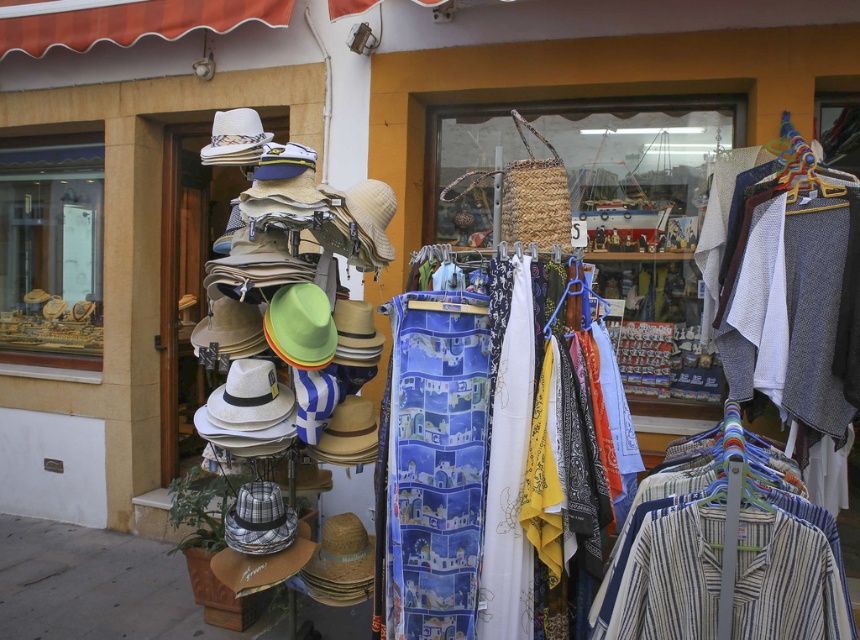
Question: Does white straw cowboy hat at center appear on the right side of white straw cowboy hat at upper center?

Choices:
 (A) no
 (B) yes

Answer: (B)

Question: Which object is the closest to the white straw cowboy hat at upper center?

Choices:
 (A) white straw cowboy hat at center
 (B) blue printed scarf at center
 (C) gold metallic jewelry at upper left
 (D) green felt cowboy hat at center

Answer: (D)

Question: Which of these objects is positioned closest to the white straw cowboy hat at center?

Choices:
 (A) gold metallic jewelry at upper left
 (B) woven straw bag at center
 (C) green felt cowboy hat at center

Answer: (C)

Question: Which of the following is the closest to the observer?

Choices:
 (A) gold metallic jewelry at upper left
 (B) white straw cowboy hat at center
 (C) white straw cowboy hat at upper center
 (D) green felt cowboy hat at center

Answer: (D)

Question: Is blue printed scarf at center below white straw cowboy hat at upper center?

Choices:
 (A) no
 (B) yes

Answer: (B)

Question: Does woven straw bag at center have a smaller size compared to white straw cowboy hat at upper center?

Choices:
 (A) no
 (B) yes

Answer: (A)